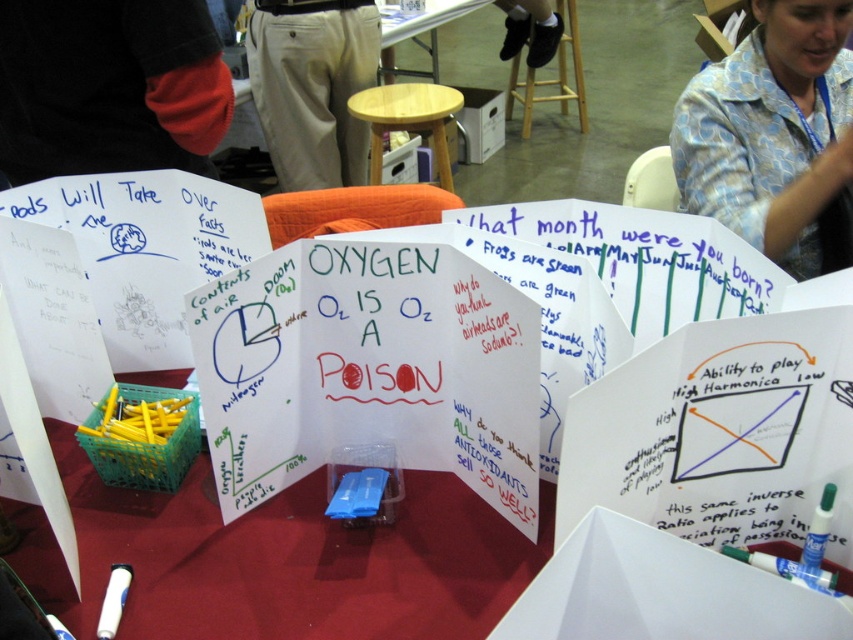
Question: Is black fabric sleeve at upper left positioned behind beech wood stool at center?

Choices:
 (A) yes
 (B) no

Answer: (B)

Question: Estimate the real-world distances between objects in this image. Which object is closer to the beech wood stool at center?

Choices:
 (A) black fabric sleeve at upper left
 (B) translucent plastic table at center
 (C) khaki cotton pants at center
 (D) wooden stool at center

Answer: (C)

Question: Which point is farther from the camera taking this photo?

Choices:
 (A) (115, 577)
 (B) (215, 72)

Answer: (B)

Question: Among these points, which one is nearest to the camera?

Choices:
 (A) (271, 618)
 (B) (424, 102)
 (C) (788, 128)

Answer: (A)

Question: Does translucent plastic table at center appear on the left side of beech wood stool at center?

Choices:
 (A) no
 (B) yes

Answer: (B)

Question: In this image, where is translucent plastic table at center located relative to black fabric sleeve at upper left?

Choices:
 (A) left
 (B) right

Answer: (B)